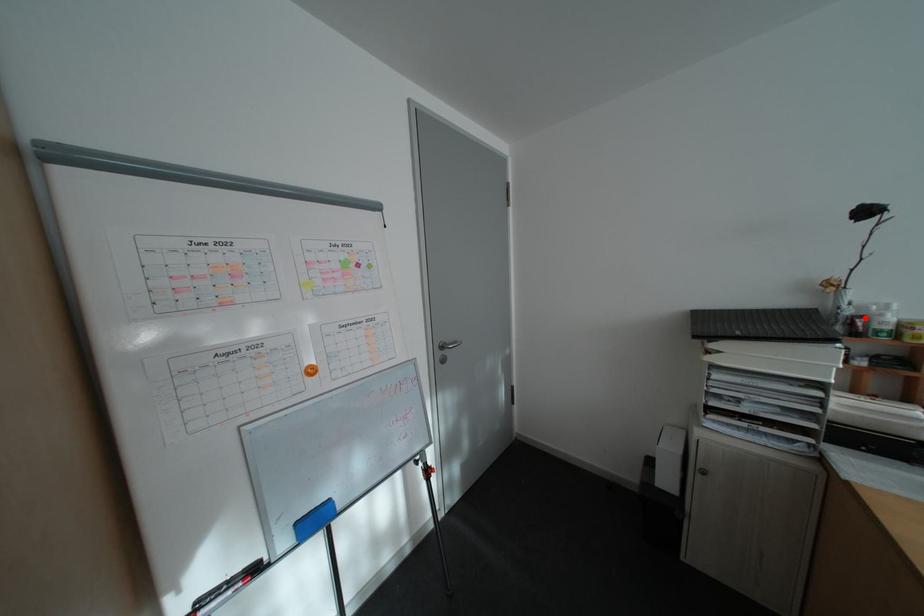
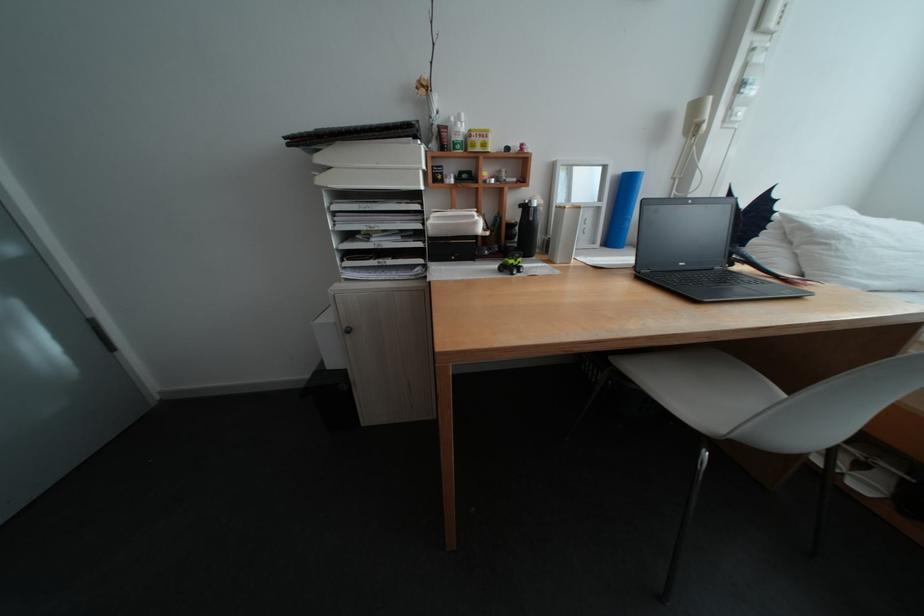
Find the pixel in the second image that matches the highlighted location in the first image.

(453, 128)